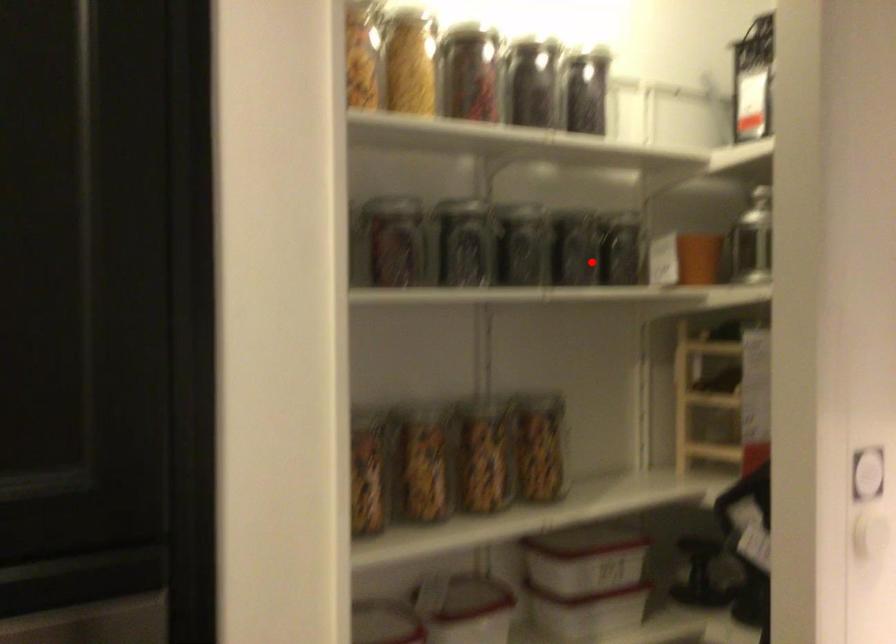
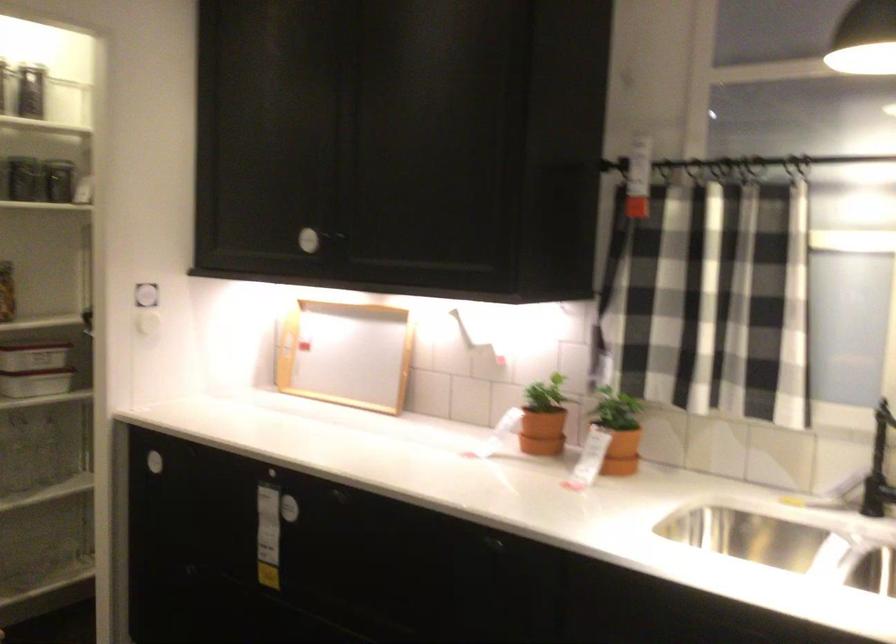
Question: A red point is marked in image1. In image2, is the corresponding 3D point closer to the camera or farther? Reply with the corresponding letter.

Choices:
 (A) The corresponding 3D point is closer.
 (B) The corresponding 3D point is farther.

Answer: (B)